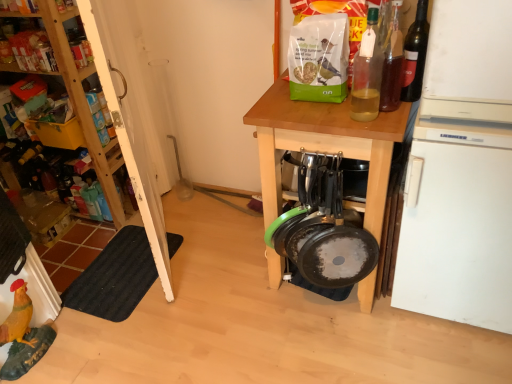
Locate an element on the screen. This screenshot has width=512, height=384. vacant space underneath black rubber mat at lower left (from a real-world perspective) is located at coordinates pyautogui.click(x=125, y=271).